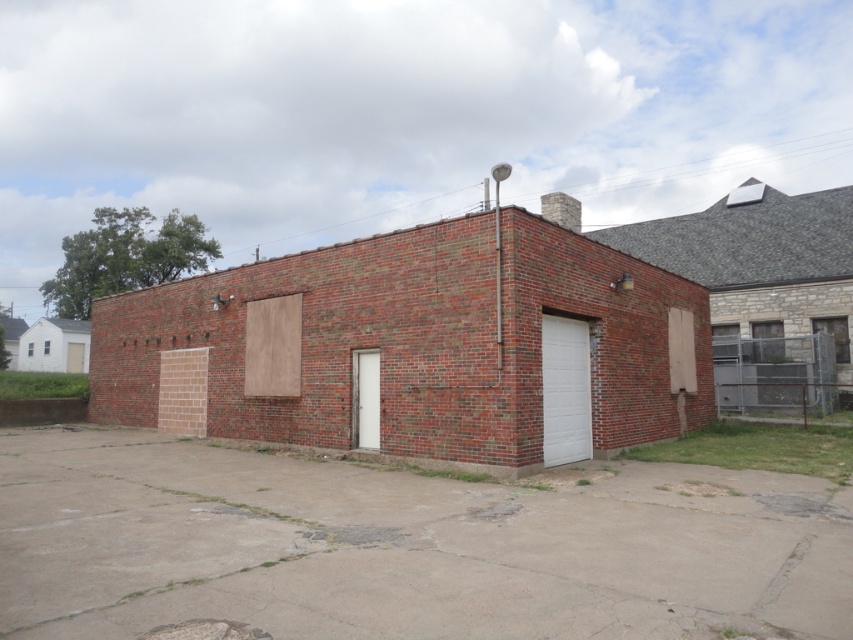
Question: Does brick garage at center have a greater width compared to white smooth garage door at center-right?

Choices:
 (A) no
 (B) yes

Answer: (B)

Question: Observing the image, what is the correct spatial positioning of brick garage at center in reference to white smooth garage door at center-right?

Choices:
 (A) below
 (B) above

Answer: (B)

Question: Considering the relative positions of brick garage at center and white smooth garage door at center-right in the image provided, where is brick garage at center located with respect to white smooth garage door at center-right?

Choices:
 (A) right
 (B) left

Answer: (B)

Question: Which point is farther to the camera?

Choices:
 (A) brick garage at center
 (B) white smooth garage door at center-right

Answer: (B)